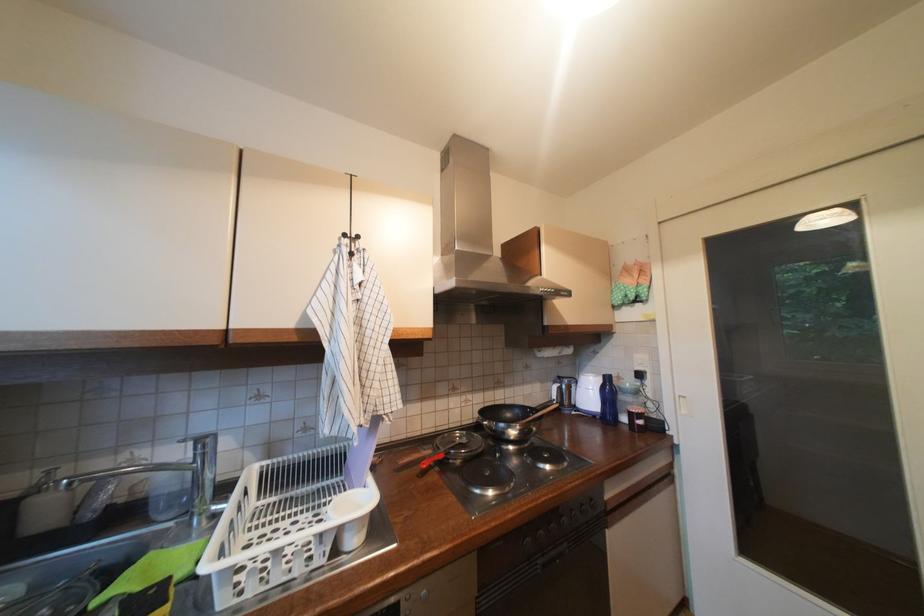
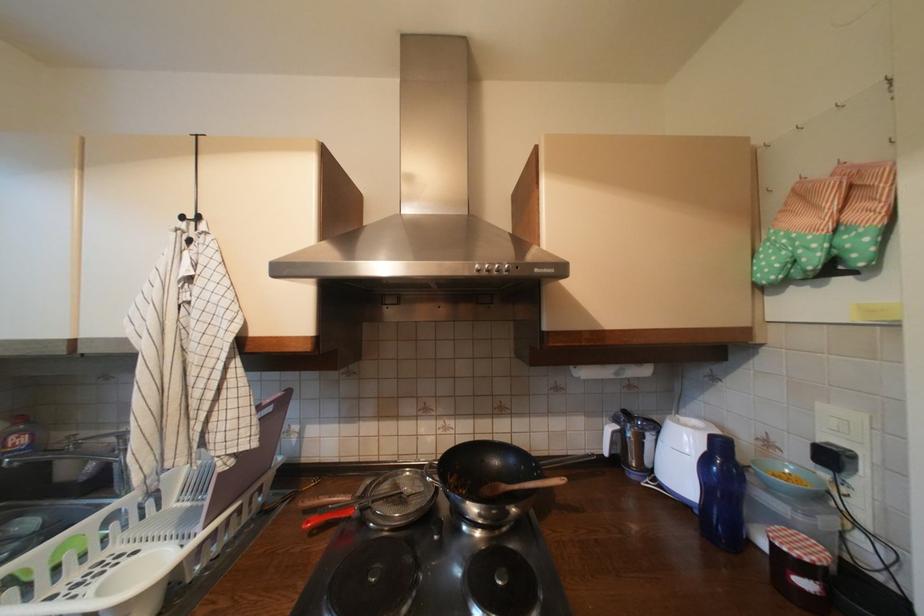
The point at (630, 294) is marked in the first image. Where is the corresponding point in the second image?

(793, 254)